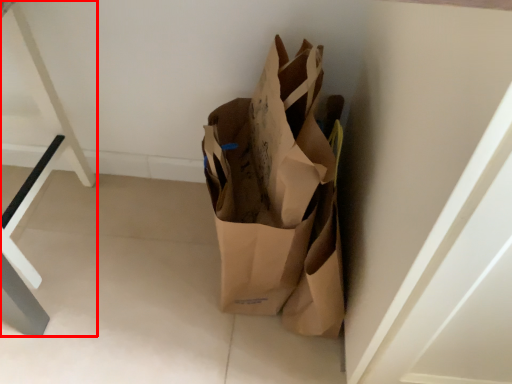
Question: From the image's perspective, considering the relative positions of furniture (annotated by the red box) and grocery bag in the image provided, where is furniture (annotated by the red box) located with respect to the staircase?

Choices:
 (A) below
 (B) above

Answer: (B)